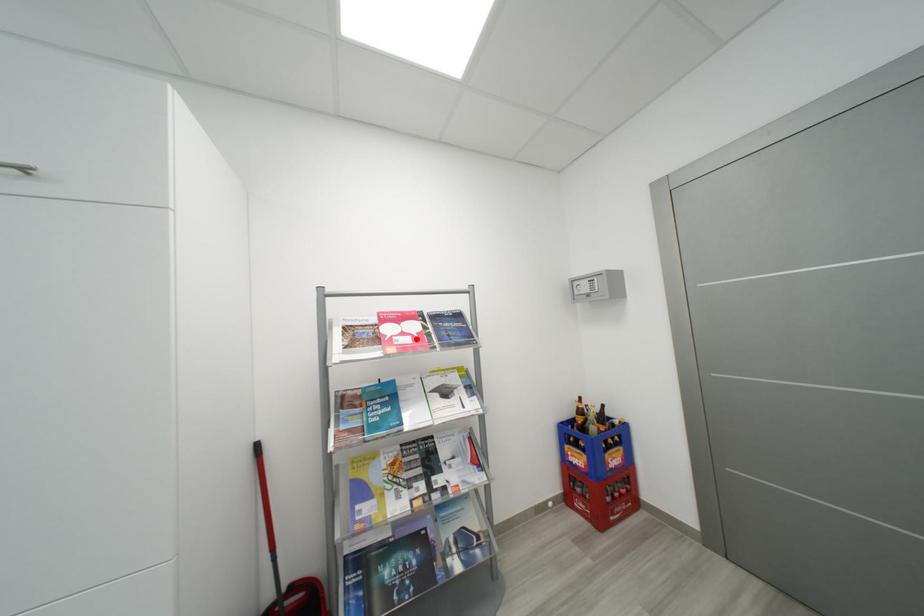
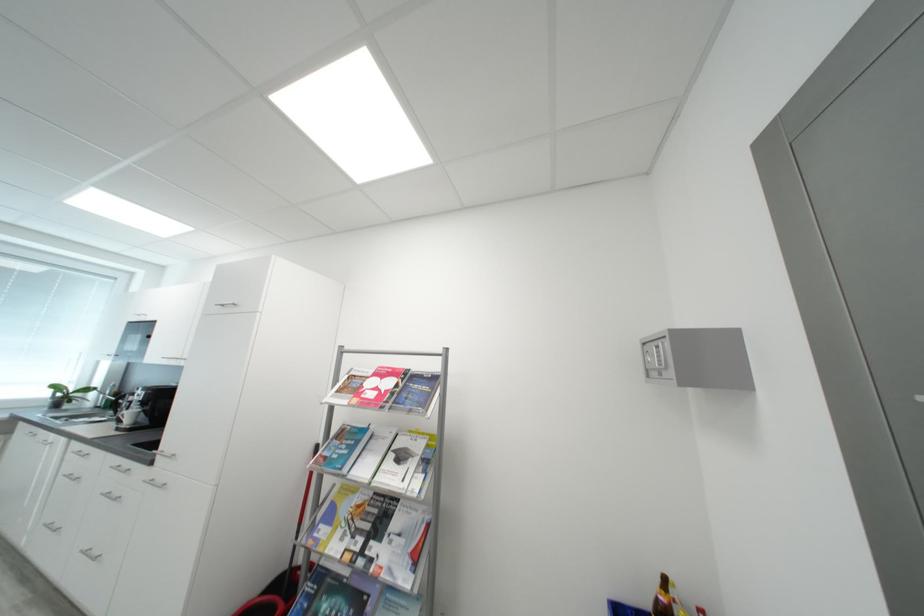
Locate, in the second image, the point that corresponds to the highlighted location in the first image.

(383, 395)